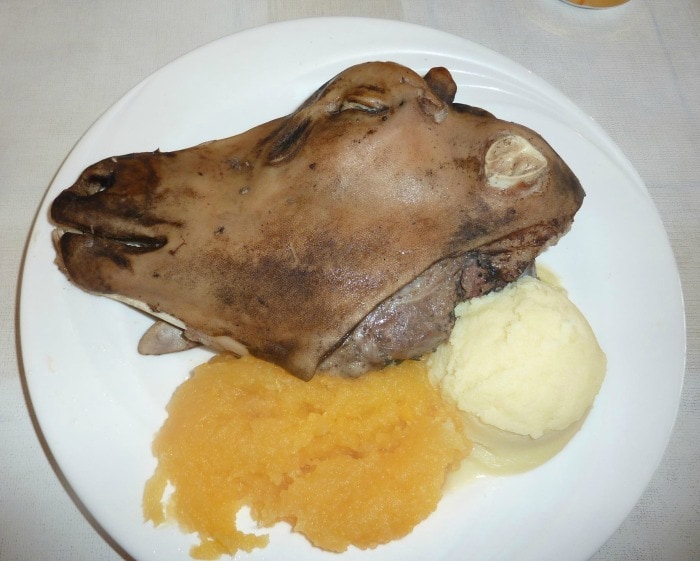
Locate an element on the screen. This screenshot has height=561, width=700. table top to left of plate is located at coordinates (5, 317).